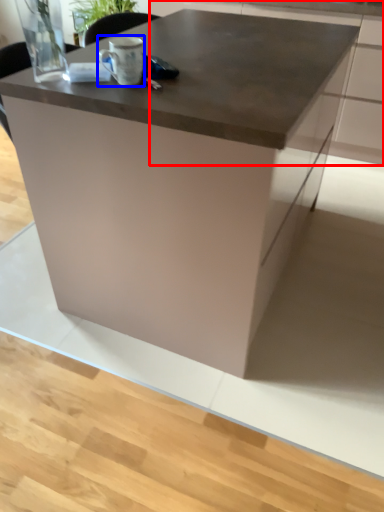
Question: Which object is further to the camera taking this photo, cabinetry (highlighted by a red box) or coffee cup (highlighted by a blue box)?

Choices:
 (A) cabinetry
 (B) coffee cup

Answer: (A)